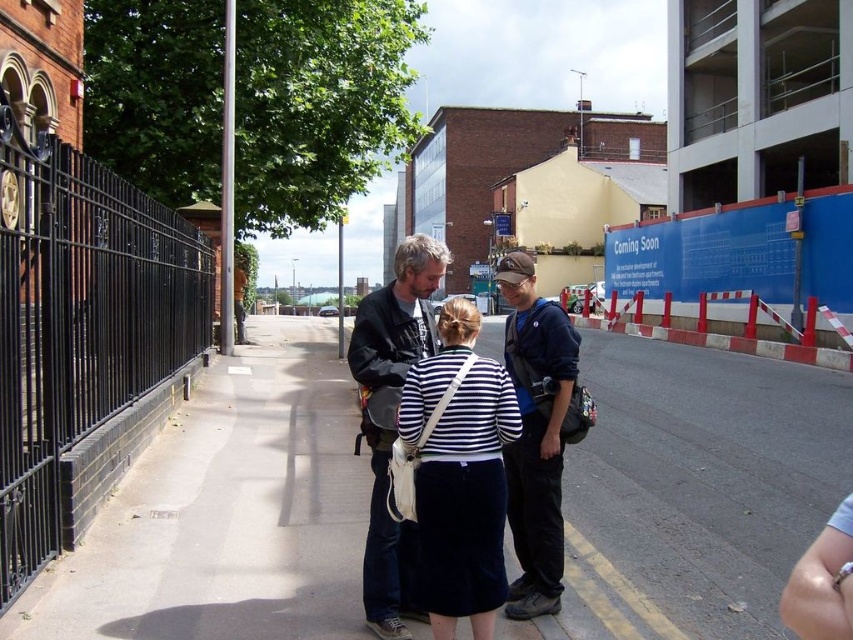
You are standing at the point labeled as point (315, 362) and want to walk to the nearest building entrance. The nearest building entrance is 30 feet away from your current position. Can you reach the entrance without crossing any roads?

The point labeled as point (315, 362) is 45.89 feet away from the viewer. Since the nearest building entrance is only 30 feet away from the point, you can reach the entrance without crossing any roads because the entrance is closer than the distance between you and the point.

You are a delivery person trying to place a large package on the sidewalk. The package is as wide as the dark blue fabric jacket at center. Can you fit the package on the concrete sidewalk at center without it hanging over the edge?

The concrete sidewalk at center is wider than the dark blue fabric jacket at center, so the package can fit without hanging over.

You are a delivery person with a cart that is 2 feet wide. You need to move from the black wrought iron fence at left to the concrete sidewalk at center. Is there enough space for your cart to pass through the gap between them?

The distance between the black wrought iron fence at left and the concrete sidewalk at center is 21.94 feet, which is more than enough space for a 2 feet wide cart to pass through.